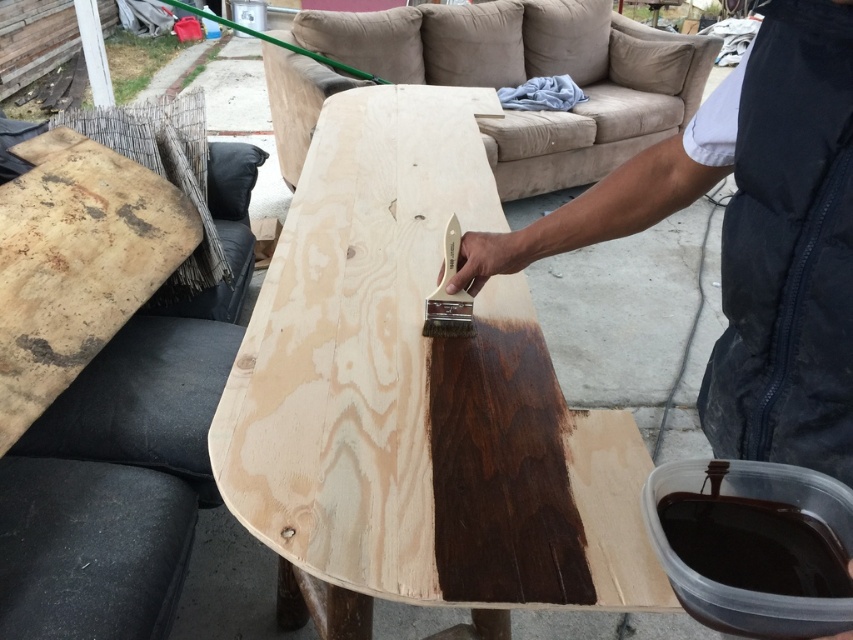
Who is more forward, (358, 461) or (65, 156)?

Point (358, 461) is more forward.

Image resolution: width=853 pixels, height=640 pixels. I want to click on stained wood table at center, so click(x=416, y=401).

Measure the distance between point (572,476) and camera.

A distance of 34.32 inches exists between point (572,476) and camera.

At what (x,y) coordinates should I click in order to perform the action: click on stained wood table at center. Please return your answer as a coordinate pair (x, y). Image resolution: width=853 pixels, height=640 pixels. Looking at the image, I should click on (416, 401).

Is dark brown wood plank at center below dark brown wood plank at upper left?

Indeed, dark brown wood plank at center is positioned under dark brown wood plank at upper left.

Is dark brown wood plank at center positioned in front of dark brown wood plank at upper left?

Yes, it is in front of dark brown wood plank at upper left.

Is point (779, 24) more distant than point (55, 218)?

No, it is not.

I want to click on dark brown wood plank at center, so click(747, 236).

Does stained wood table at center appear over dark brown wood plank at center?

Indeed, stained wood table at center is positioned over dark brown wood plank at center.

Who is lower down, stained wood table at center or dark brown wood plank at center?

dark brown wood plank at center is lower down.

Locate an element on the screen. This screenshot has height=640, width=853. stained wood table at center is located at coordinates (416, 401).

The height and width of the screenshot is (640, 853). I want to click on stained wood table at center, so click(416, 401).